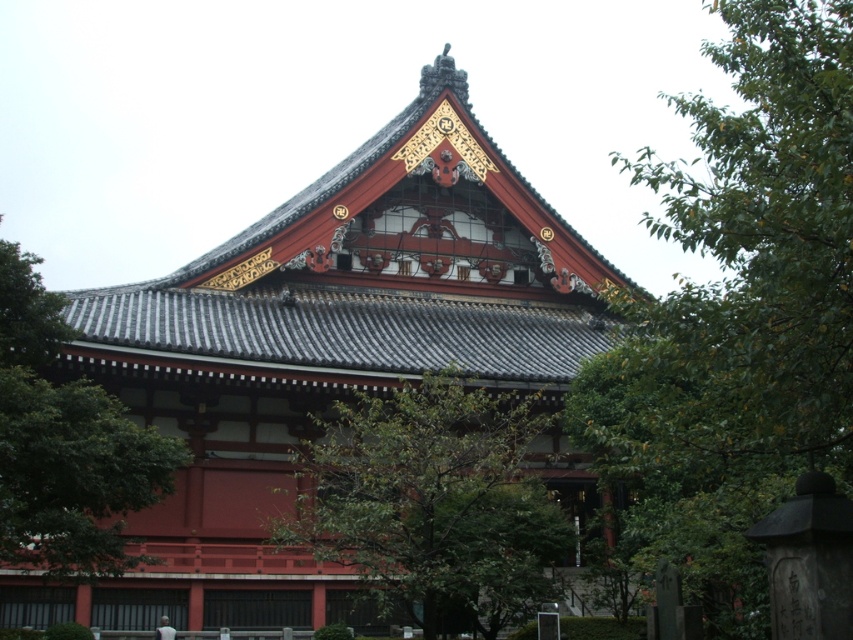
You are a visitor at the temple and want to take a photo that includes both the green leafy tree at upper right and the green leafy tree at upper left. Which tree should you position closer to the center of the frame to ensure both are fully visible?

You should position the green leafy tree at upper right closer to the center of the frame because it is bigger than the green leafy tree at upper left, allowing both to fit within the photo.

You are an architect analyzing the spatial arrangement of the temple. Which green leafy tree is located higher up in the image, the green leafy tree at upper right or the green leafy tree at center?

The green leafy tree at upper right is positioned over the green leafy tree at center, so it is higher up in the image.

You are standing in front of a traditional Japanese temple with a steeply pitched roof and vibrant colors. You notice a point marked at coordinates (x=738, y=314). What object is located at this point?

The point at coordinates (x=738, y=314) indicates a green leafy tree at upper right.